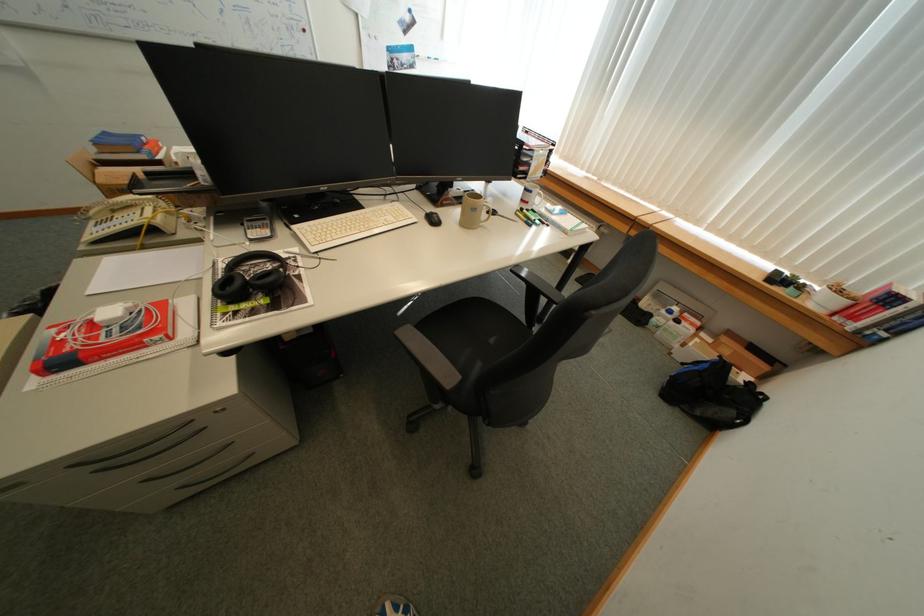
Where is `red screwdriver`? Image resolution: width=924 pixels, height=616 pixels. red screwdriver is located at coordinates (103, 337).